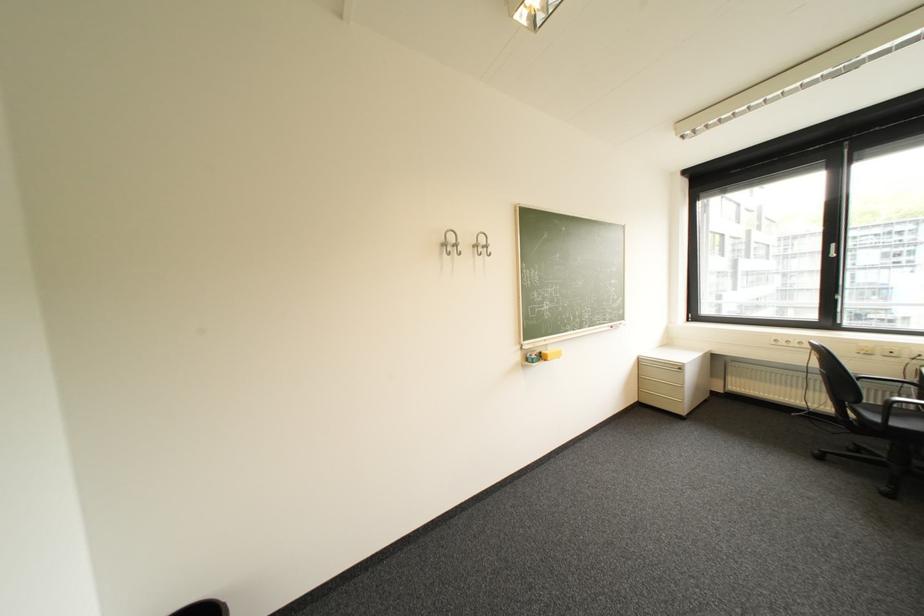
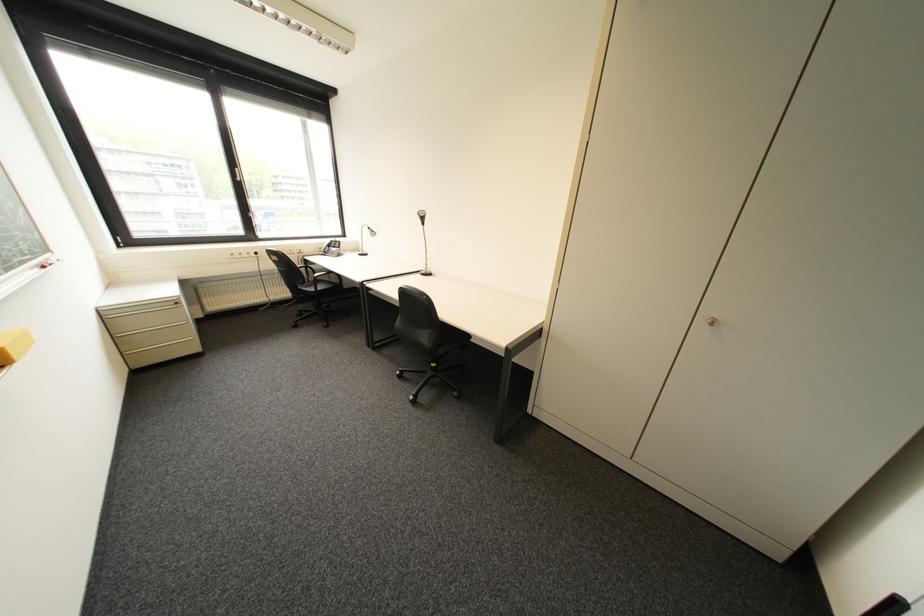
The point at (862, 448) is marked in the first image. Where is the corresponding point in the second image?

(309, 314)